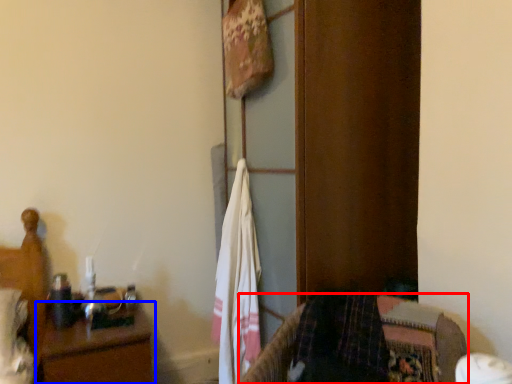
Question: Among these objects, which one is nearest to the camera, furniture (highlighted by a red box) or nightstand (highlighted by a blue box)?

Choices:
 (A) furniture
 (B) nightstand

Answer: (A)